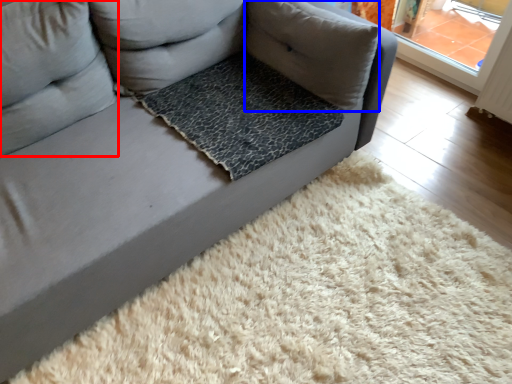
Question: Which of the following is the closest to the observer, pillow (highlighted by a red box) or pillow (highlighted by a blue box)?

Choices:
 (A) pillow
 (B) pillow

Answer: (A)